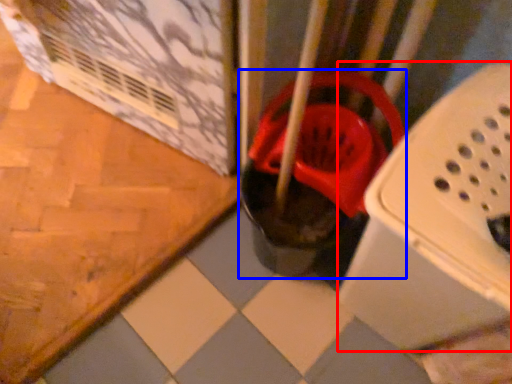
Question: Which of the following is the farthest to the observer, box (highlighted by a red box) or footwear (highlighted by a blue box)?

Choices:
 (A) box
 (B) footwear

Answer: (B)